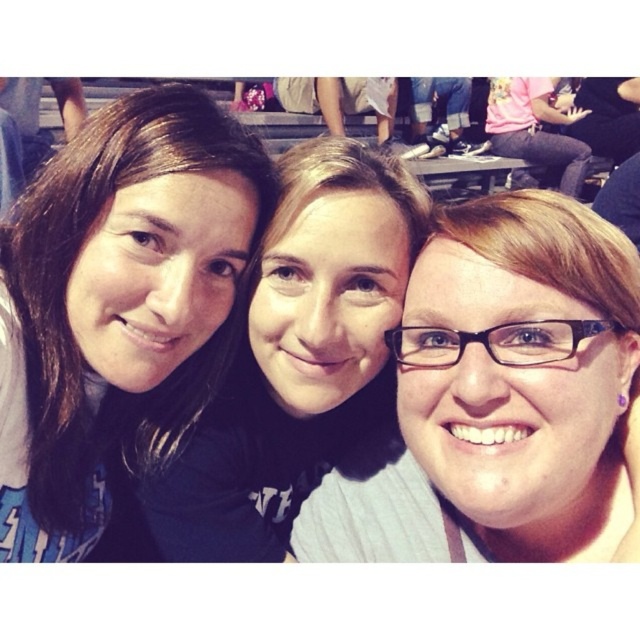
You are trying to locate the matte black glasses at center in the image. Which coordinates should you look at?

You should look at coordinates point (502, 397) to find the matte black glasses at center.

You are taking a photo of three friends in a stadium. You notice the brown hair at left and the matte black glasses at center. Which one is positioned higher in the frame?

The brown hair at left is positioned higher in the frame than the matte black glasses at center.